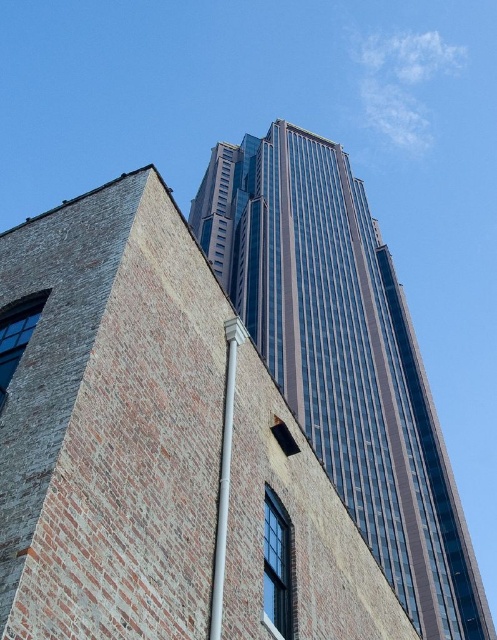
Is glassy reflective skyscraper at center thinner than white plastic pipe at center?

In fact, glassy reflective skyscraper at center might be wider than white plastic pipe at center.

Does glassy reflective skyscraper at center appear on the left side of white plastic pipe at center?

In fact, glassy reflective skyscraper at center is to the right of white plastic pipe at center.

Is point (331, 456) farther from camera compared to point (220, 464)?

Yes, point (331, 456) is behind point (220, 464).

This screenshot has height=640, width=497. Identify the location of glassy reflective skyscraper at center. 343,356.